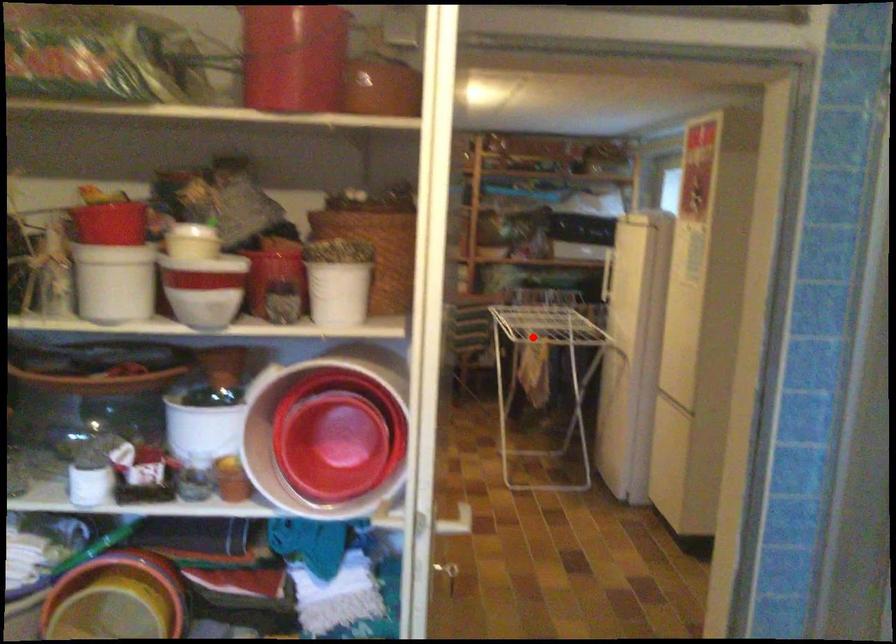
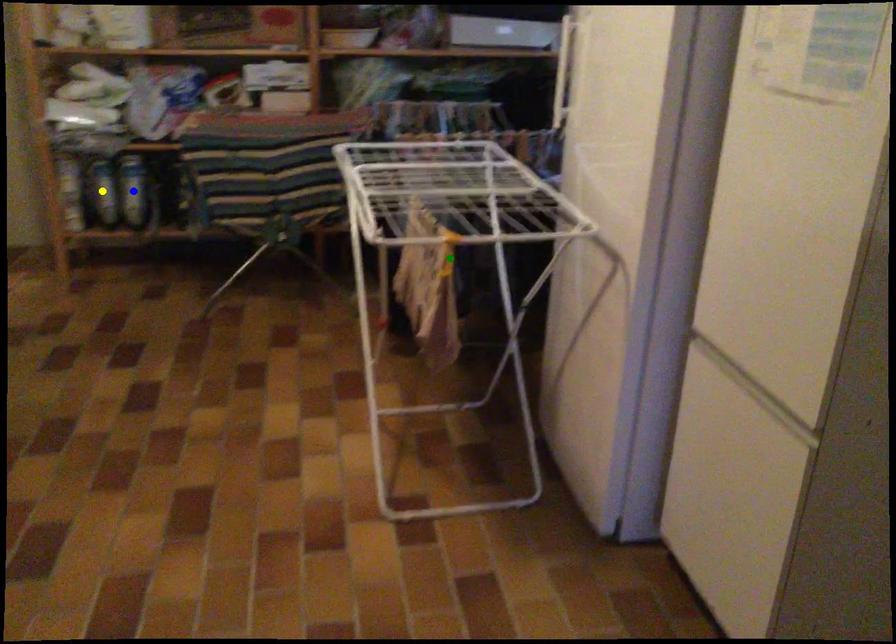
Question: I am providing you with two images of the same scene from different viewpoints. A red point is marked on the first image. You are given multiple points on the second image. In image 2, which mark is for the same physical point as the one in image 1?

Choices:
 (A) yellow point
 (B) blue point
 (C) green point

Answer: (C)